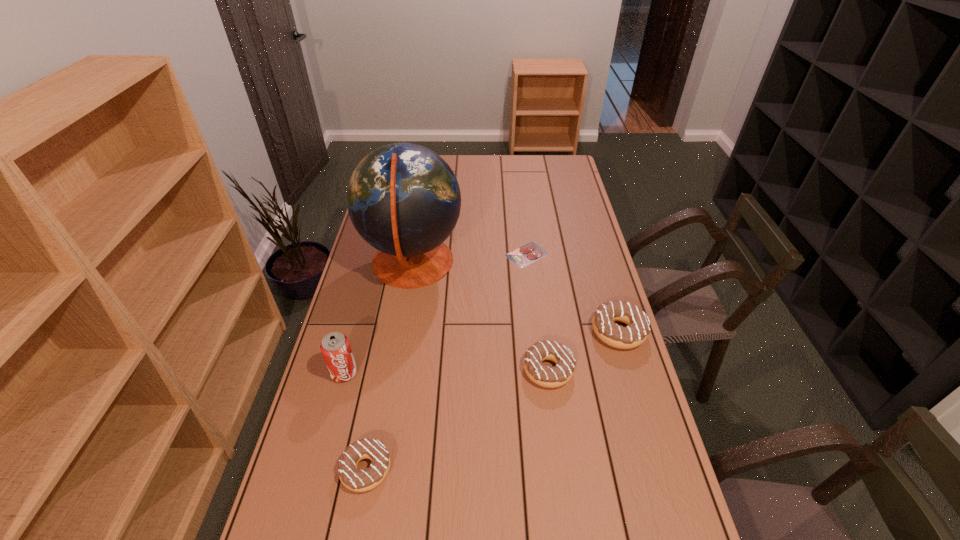
Please point a spot to place another doughnut for symmetrical spacing. Please provide its 2D coordinates. Your answer should be formatted as a tuple, i.e. [(x, y)], where the tuple contains the x and y coordinates of a point satisfying the conditions above.

[(466, 415)]